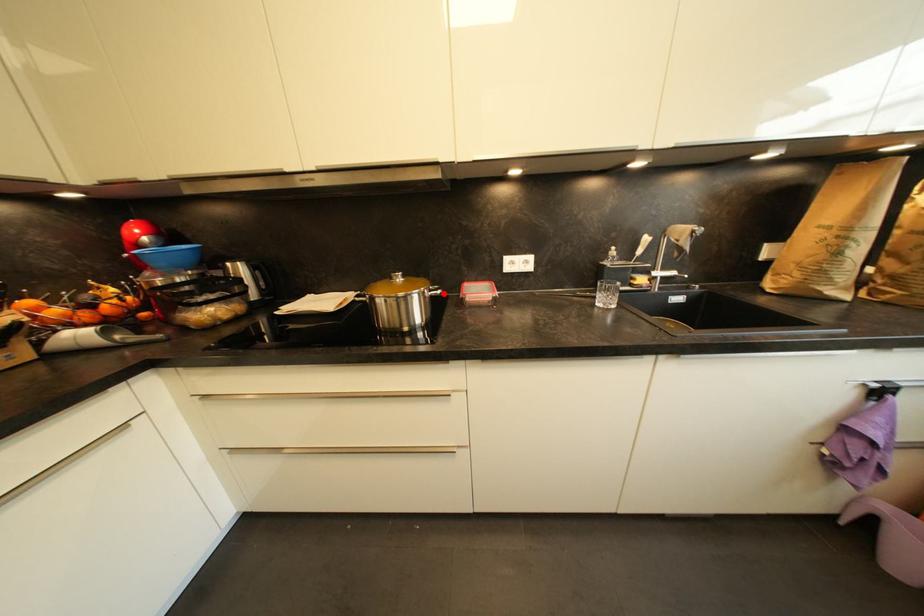
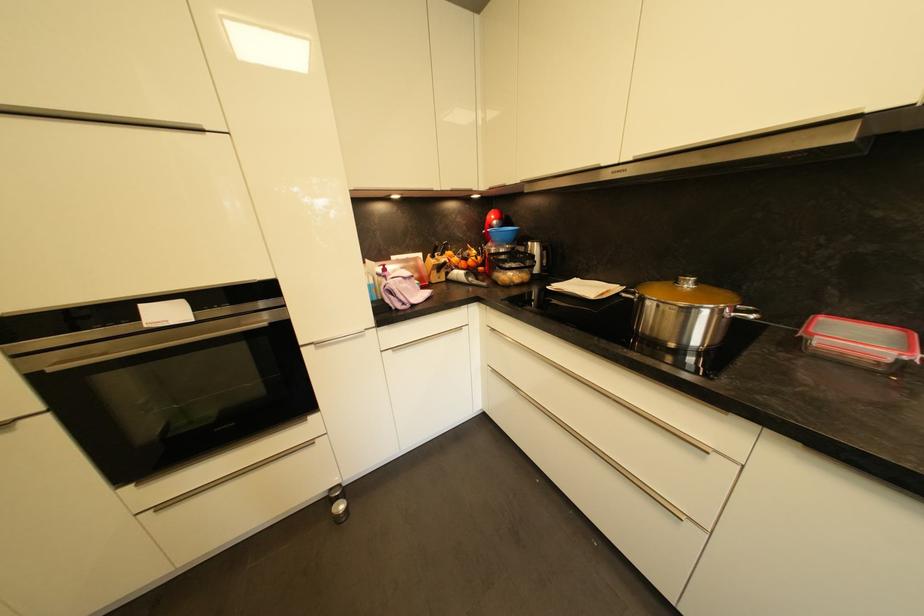
Locate, in the second image, the point that corresponds to the highlighted location in the first image.

(758, 318)